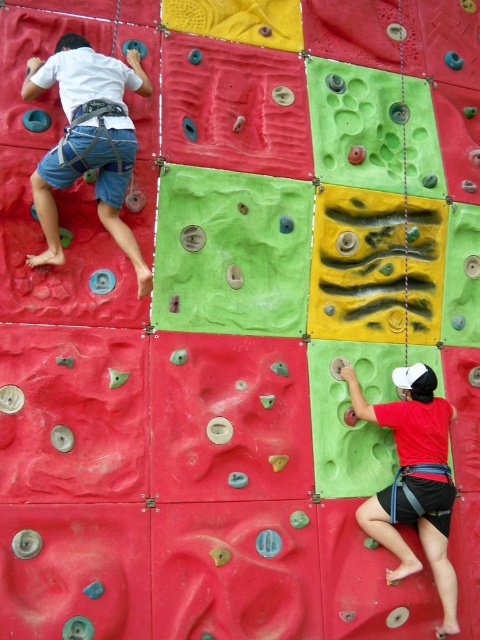
You are a safety inspector checking the distance between two climbers on an artificial climbing wall. The safety guidelines require a minimum distance of 10 feet between climbers to prevent collisions. Based on the image, can the current distance between the matte white climbing harness at upper left and the matte red shorts at lower right meet the safety requirement?

The distance between the matte white climbing harness at upper left and the matte red shorts at lower right is 9.91 feet, which is less than the required 10 feet. Therefore, the safety requirement is not met.

You are a rock climbing instructor observing the scene. You notice the matte white climbing harness at upper left and the matte red shorts at lower right. Which object appears bigger in the image?

The matte white climbing harness at upper left is larger in size than the matte red shorts at lower right.

You are a rock climbing instructor observing the climbers. You notice the matte white climbing harness at upper left and the matte red shorts at lower right. Which object is positioned higher on the climbing wall?

The matte white climbing harness at upper left is positioned higher on the climbing wall than the matte red shorts at lower right.